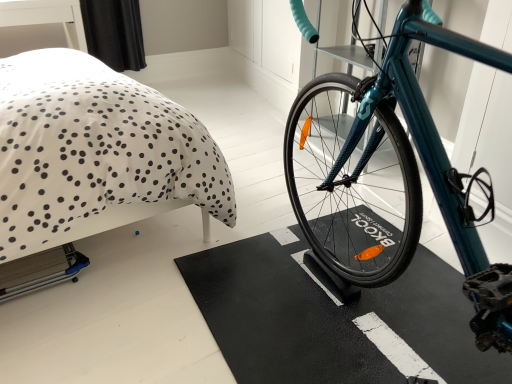
Where is `white dotted fabric at upper left`? This screenshot has height=384, width=512. white dotted fabric at upper left is located at coordinates (94, 148).

What do you see at coordinates (94, 148) in the screenshot? I see `white dotted fabric at upper left` at bounding box center [94, 148].

What do you see at coordinates (392, 175) in the screenshot? I see `teal glossy bicycle at center` at bounding box center [392, 175].

What is the approximate height of teal glossy bicycle at center?

teal glossy bicycle at center is 35.87 inches in height.

The width and height of the screenshot is (512, 384). Describe the element at coordinates (330, 318) in the screenshot. I see `black rubber bath mat at center` at that location.

The width and height of the screenshot is (512, 384). What are the coordinates of `white dotted fabric at upper left` in the screenshot? It's located at (94, 148).

Which is less distant, (385, 322) or (97, 114)?

Point (385, 322) is closer to the camera than point (97, 114).

Considering the relative positions of black rubber bath mat at center and white dotted fabric at upper left in the image provided, is black rubber bath mat at center to the left of white dotted fabric at upper left from the viewer's perspective?

In fact, black rubber bath mat at center is to the right of white dotted fabric at upper left.

Looking at this image, between black rubber bath mat at center and white dotted fabric at upper left, which one has smaller width?

→ With smaller width is white dotted fabric at upper left.

Which of these two, black rubber bath mat at center or white dotted fabric at upper left, stands taller?

With more height is white dotted fabric at upper left.

Considering the positions of objects teal glossy bicycle at center and black rubber bath mat at center in the image provided, who is more to the left, teal glossy bicycle at center or black rubber bath mat at center?

From the viewer's perspective, black rubber bath mat at center appears more on the left side.

Is teal glossy bicycle at center in front of or behind black rubber bath mat at center in the image?

teal glossy bicycle at center is positioned closer to the viewer than black rubber bath mat at center.

From the image's perspective, is teal glossy bicycle at center above or below black rubber bath mat at center?

teal glossy bicycle at center is above black rubber bath mat at center.

Which is closer to the camera, (x=479, y=275) or (x=440, y=354)?

Point (x=479, y=275) is closer to the camera than point (x=440, y=354).

From the image's perspective, is white dotted fabric at upper left under black rubber bath mat at center?

No.

From a real-world perspective, which is physically below, white dotted fabric at upper left or black rubber bath mat at center?

black rubber bath mat at center is physically lower.

Is white dotted fabric at upper left directly adjacent to black rubber bath mat at center?

No, white dotted fabric at upper left is not making contact with black rubber bath mat at center.

Does white dotted fabric at upper left have a smaller size compared to black rubber bath mat at center?

No.

How different are the orientations of white dotted fabric at upper left and teal glossy bicycle at center in degrees?

There is a 79.3-degree angle between the facing directions of white dotted fabric at upper left and teal glossy bicycle at center.

Which of these two, white dotted fabric at upper left or teal glossy bicycle at center, is wider?

teal glossy bicycle at center is wider.

Which is behind, point (73, 92) or point (369, 111)?

The point (73, 92) is more distant.

Between white dotted fabric at upper left and teal glossy bicycle at center, which one has smaller size?

teal glossy bicycle at center.

Does teal glossy bicycle at center have a greater height compared to white dotted fabric at upper left?

In fact, teal glossy bicycle at center may be shorter than white dotted fabric at upper left.

Between teal glossy bicycle at center and white dotted fabric at upper left, which one has smaller width?

white dotted fabric at upper left is thinner.

Is point (318, 198) in front of point (51, 163)?

No, it is behind (51, 163).

Measure the distance from teal glossy bicycle at center to white dotted fabric at upper left.

They are 30.06 inches apart.

Considering the sizes of objects black rubber bath mat at center and teal glossy bicycle at center in the image provided, who is wider, black rubber bath mat at center or teal glossy bicycle at center?

teal glossy bicycle at center is wider.

Which is correct: black rubber bath mat at center is inside teal glossy bicycle at center, or outside of it?

black rubber bath mat at center lies outside teal glossy bicycle at center.

Is black rubber bath mat at center next to teal glossy bicycle at center?

There is a gap between black rubber bath mat at center and teal glossy bicycle at center.

From the image's perspective, between black rubber bath mat at center and teal glossy bicycle at center, which one is located above?

From the image's view, teal glossy bicycle at center is above.

Locate an element on the screen. bath mat that appears on the right of white dotted fabric at upper left is located at coordinates (330, 318).

Locate an element on the screen. bicycle that appears in front of the black rubber bath mat at center is located at coordinates (392, 175).

When comparing their distances from teal glossy bicycle at center, does white dotted fabric at upper left or black rubber bath mat at center seem further?

white dotted fabric at upper left is further to teal glossy bicycle at center.

Considering their positions, is teal glossy bicycle at center positioned further to white dotted fabric at upper left than black rubber bath mat at center?

teal glossy bicycle at center lies further to white dotted fabric at upper left than the other object.

Based on their spatial positions, is black rubber bath mat at center or white dotted fabric at upper left further from teal glossy bicycle at center?

Among the two, white dotted fabric at upper left is located further to teal glossy bicycle at center.

Looking at the image, which one is located further to black rubber bath mat at center, white dotted fabric at upper left or teal glossy bicycle at center?

Among the two, white dotted fabric at upper left is located further to black rubber bath mat at center.

Looking at the image, which one is located further to white dotted fabric at upper left, black rubber bath mat at center or teal glossy bicycle at center?

Based on the image, teal glossy bicycle at center appears to be further to white dotted fabric at upper left.

Which object lies nearer to the anchor point black rubber bath mat at center, teal glossy bicycle at center or white dotted fabric at upper left?

The object closer to black rubber bath mat at center is teal glossy bicycle at center.

Locate an element on the screen. bath mat between white dotted fabric at upper left and teal glossy bicycle at center in the horizontal direction is located at coordinates (330, 318).